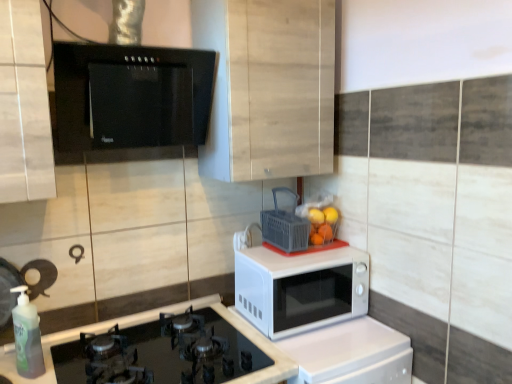
Question: Considering the relative sizes of orange matte at upper right, the 1th orange in the right-to-left sequence, and green translucent bottle at lower left in the image provided, is orange matte at upper right, the 1th orange in the right-to-left sequence, bigger than green translucent bottle at lower left?

Choices:
 (A) no
 (B) yes

Answer: (A)

Question: Is orange matte at upper right, the 1th orange in the right-to-left sequence, far from green translucent bottle at lower left?

Choices:
 (A) no
 (B) yes

Answer: (B)

Question: Is orange matte at upper right, the 1th orange in the right-to-left sequence, taller than green translucent bottle at lower left?

Choices:
 (A) no
 (B) yes

Answer: (A)

Question: Is orange matte at upper right, the 1th orange in the right-to-left sequence, outside of green translucent bottle at lower left?

Choices:
 (A) no
 (B) yes

Answer: (B)

Question: Can you confirm if orange matte at upper right, the 1th orange in the right-to-left sequence, is wider than green translucent bottle at lower left?

Choices:
 (A) yes
 (B) no

Answer: (B)

Question: Considering the relative positions of black glass gas stove at lower left and orange matte at upper right, the 1th orange in the right-to-left sequence, in the image provided, is black glass gas stove at lower left to the left or to the right of orange matte at upper right, the 1th orange in the right-to-left sequence,?

Choices:
 (A) right
 (B) left

Answer: (B)

Question: From the image's perspective, relative to orange matte at upper right, which ranks as the 2th orange in left-to-right order, is black glass gas stove at lower left above or below?

Choices:
 (A) below
 (B) above

Answer: (A)

Question: In terms of width, does black glass gas stove at lower left look wider or thinner when compared to orange matte at upper right, the 1th orange in the right-to-left sequence?

Choices:
 (A) thin
 (B) wide

Answer: (B)

Question: Looking at the image, does black glass gas stove at lower left seem bigger or smaller compared to orange matte at upper right, which ranks as the 2th orange in left-to-right order?

Choices:
 (A) big
 (B) small

Answer: (A)

Question: Based on their positions, is gray plastic basket at center located to the left or right of orange matte at upper right, placed as the second orange when sorted from right to left?

Choices:
 (A) right
 (B) left

Answer: (B)

Question: From a real-world perspective, is gray plastic basket at center above or below orange matte at upper right, placed as the second orange when sorted from right to left?

Choices:
 (A) below
 (B) above

Answer: (B)

Question: Considering the positions of point (276, 205) and point (321, 211), is point (276, 205) closer or farther from the camera than point (321, 211)?

Choices:
 (A) farther
 (B) closer

Answer: (A)

Question: Considering the positions of gray plastic basket at center and orange matte at upper right, positioned as the first orange in left-to-right order, in the image, is gray plastic basket at center taller or shorter than orange matte at upper right, positioned as the first orange in left-to-right order,?

Choices:
 (A) short
 (B) tall

Answer: (B)

Question: Does point (329, 334) appear closer or farther from the camera than point (293, 228)?

Choices:
 (A) closer
 (B) farther

Answer: (A)

Question: In the image, is white glossy microwave at center on the left side or the right side of gray plastic basket at center?

Choices:
 (A) right
 (B) left

Answer: (A)